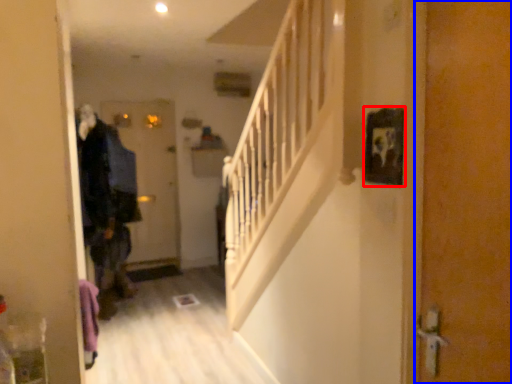
Question: Which object is closer to the camera taking this photo, picture frame (highlighted by a red box) or door (highlighted by a blue box)?

Choices:
 (A) picture frame
 (B) door

Answer: (B)